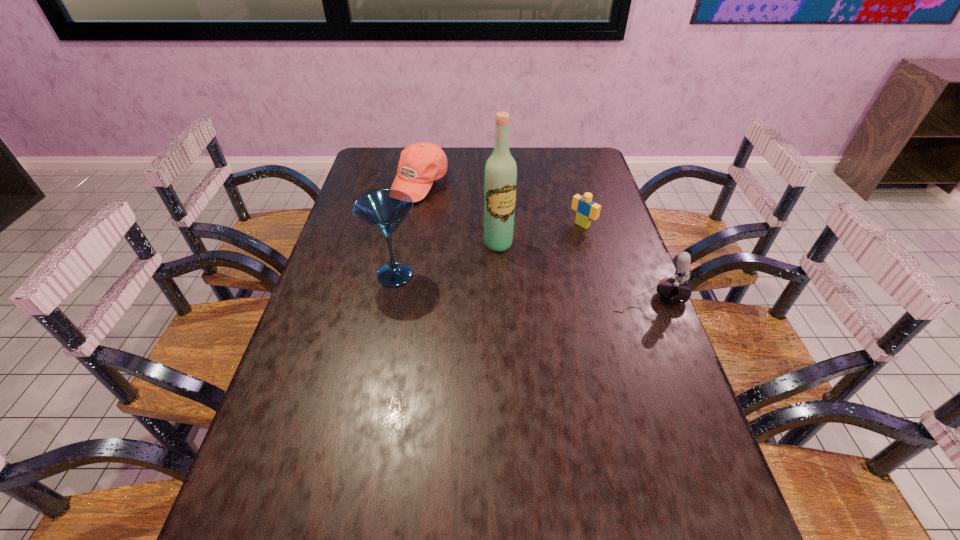
The width and height of the screenshot is (960, 540). I want to click on vacant spot on the desktop that is between the martini and the microphone and is positioned on the front-facing side of the farthest object, so click(x=528, y=287).

Where is `vacant space on the desktop that is between the martini and the microphone and is positioned on the front-facing side of the third object from right to left`? vacant space on the desktop that is between the martini and the microphone and is positioned on the front-facing side of the third object from right to left is located at coordinates tap(526, 287).

Where is `free space on the desktop that is between the martini and the microphone and is positioned on the face of the fourth nearest object`? This screenshot has width=960, height=540. free space on the desktop that is between the martini and the microphone and is positioned on the face of the fourth nearest object is located at coordinates (496, 284).